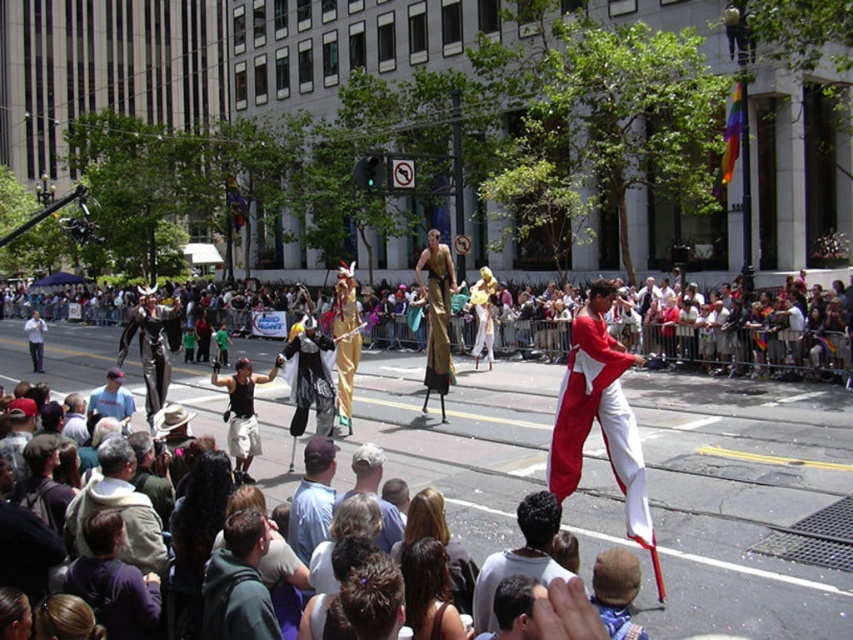
Is matte red and white pants at center behind gold metallic statue at center?

No, it is not.

Between matte red and white pants at center and gold metallic statue at center, which one has less height?

With less height is matte red and white pants at center.

At what (x,y) coordinates should I click in order to perform the action: click on matte red and white pants at center. Please return your answer as a coordinate pair (x, y). The width and height of the screenshot is (853, 640). Looking at the image, I should click on (598, 422).

This screenshot has width=853, height=640. Identify the location of matte red and white pants at center. (598, 422).

Between dark brown hair at lower center and matte black shirt at center, which one is positioned higher?

Positioned higher is matte black shirt at center.

Measure the distance between point (479, 620) and camera.

The distance of point (479, 620) from camera is 4.78 meters.

This screenshot has width=853, height=640. I want to click on dark brown hair at lower center, so 520,556.

Describe the element at coordinates (238, 582) in the screenshot. I see `dark green hoodie at lower left` at that location.

Who is more distant from viewer, (213, 602) or (128, 392)?

Point (128, 392)

What do you see at coordinates (238, 582) in the screenshot? Image resolution: width=853 pixels, height=640 pixels. I see `dark green hoodie at lower left` at bounding box center [238, 582].

Find the location of a particular element. The height and width of the screenshot is (640, 853). dark green hoodie at lower left is located at coordinates point(238,582).